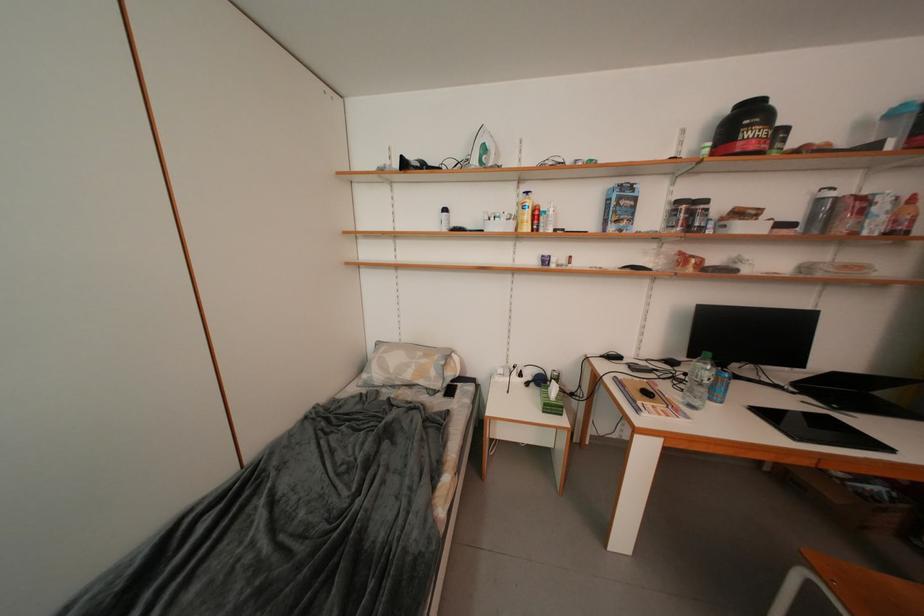
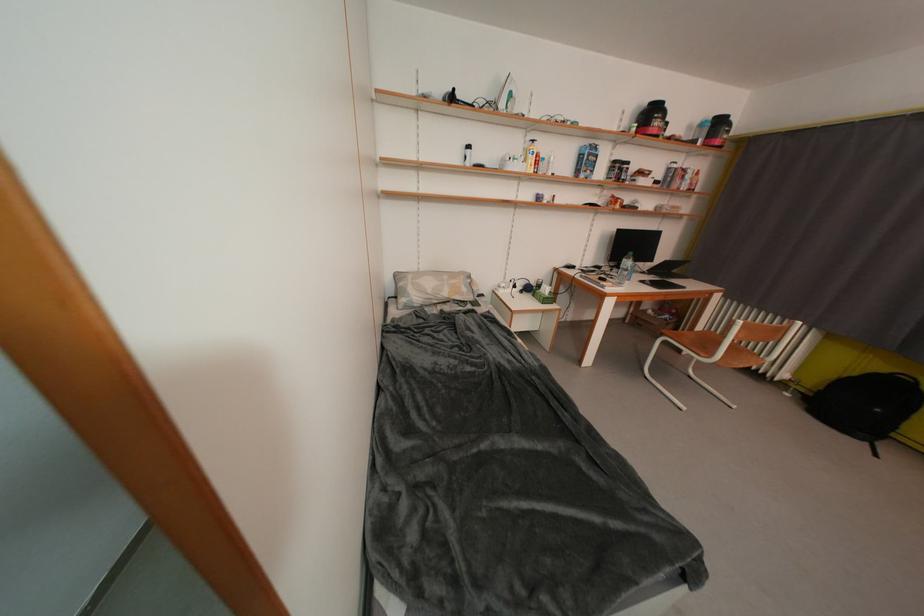
The point at [441,376] is marked in the first image. Where is the corresponding point in the second image?

(471, 293)